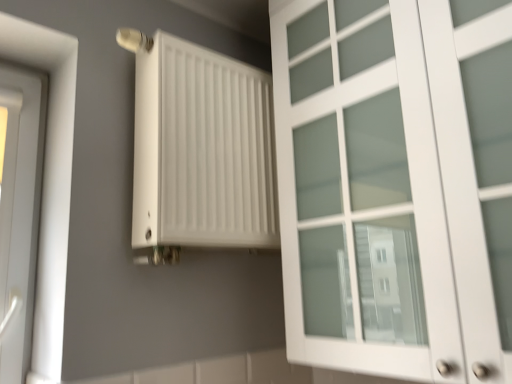
Question: Do you think white matte radiator at upper left is within white matte cabinet at right, or outside of it?

Choices:
 (A) inside
 (B) outside

Answer: (B)

Question: From a real-world perspective, is white matte radiator at upper left positioned above or below white matte cabinet at right?

Choices:
 (A) below
 (B) above

Answer: (B)

Question: From the image's perspective, is white matte radiator at upper left positioned above or below white matte cabinet at right?

Choices:
 (A) above
 (B) below

Answer: (B)

Question: Relative to white matte radiator at upper left, is white matte cabinet at right in front or behind?

Choices:
 (A) behind
 (B) front

Answer: (B)

Question: Based on their sizes in the image, would you say white matte cabinet at right is bigger or smaller than white matte radiator at upper left?

Choices:
 (A) big
 (B) small

Answer: (A)

Question: Is white matte cabinet at right to the left or to the right of white matte radiator at upper left in the image?

Choices:
 (A) left
 (B) right

Answer: (B)

Question: From a real-world perspective, relative to white matte radiator at upper left, is white matte cabinet at right vertically above or below?

Choices:
 (A) below
 (B) above

Answer: (A)